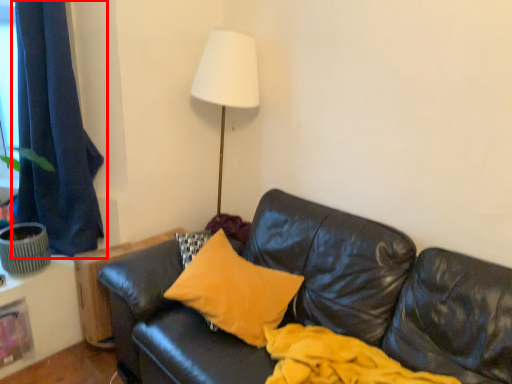
Question: Observing the image, what is the correct spatial positioning of curtain (annotated by the red box) in reference to pillow?

Choices:
 (A) right
 (B) left

Answer: (B)